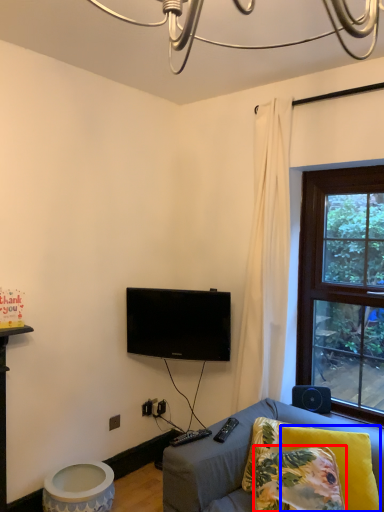
Question: Which object is closer to the camera taking this photo, pillow (highlighted by a red box) or pillow (highlighted by a blue box)?

Choices:
 (A) pillow
 (B) pillow

Answer: (A)